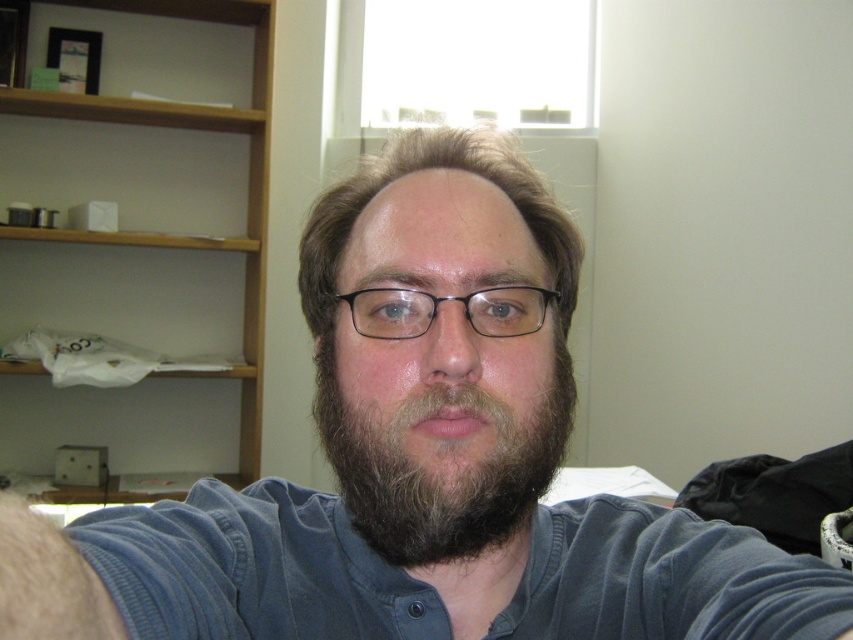
Question: Does wooden bookshelf at upper left have a lesser width compared to black plastic glasses at center?

Choices:
 (A) yes
 (B) no

Answer: (B)

Question: Can you confirm if wooden bookshelf at upper left is wider than black plastic glasses at center?

Choices:
 (A) yes
 (B) no

Answer: (A)

Question: Does dark brown fuzzy beard at center have a smaller size compared to black plastic glasses at center?

Choices:
 (A) no
 (B) yes

Answer: (A)

Question: Which of the following is the farthest from the observer?

Choices:
 (A) wooden bookshelf at upper left
 (B) black plastic glasses at center
 (C) dark brown fuzzy beard at center

Answer: (A)

Question: Which point is closer to the camera?

Choices:
 (A) black plastic glasses at center
 (B) dark brown fuzzy beard at center
 (C) wooden bookshelf at upper left

Answer: (B)

Question: Which point is farther to the camera?

Choices:
 (A) (192, 348)
 (B) (485, 536)

Answer: (A)